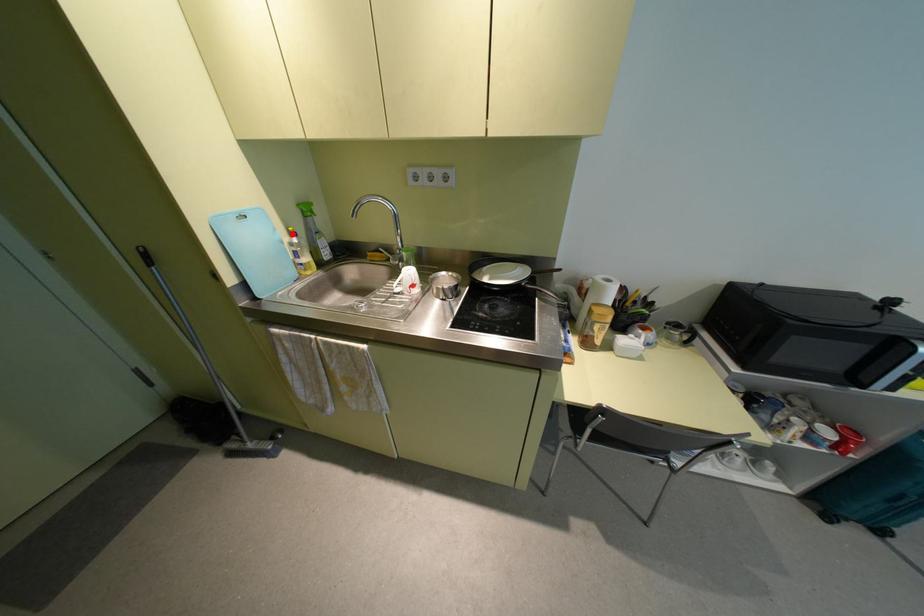
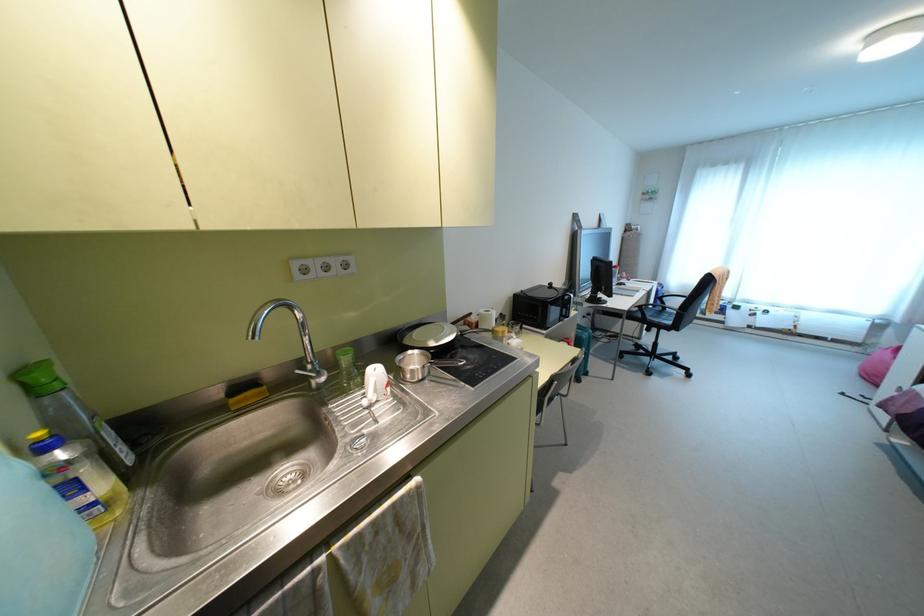
Where in the second image is the point corresponding to the highlighted location from the first image?

(43, 447)